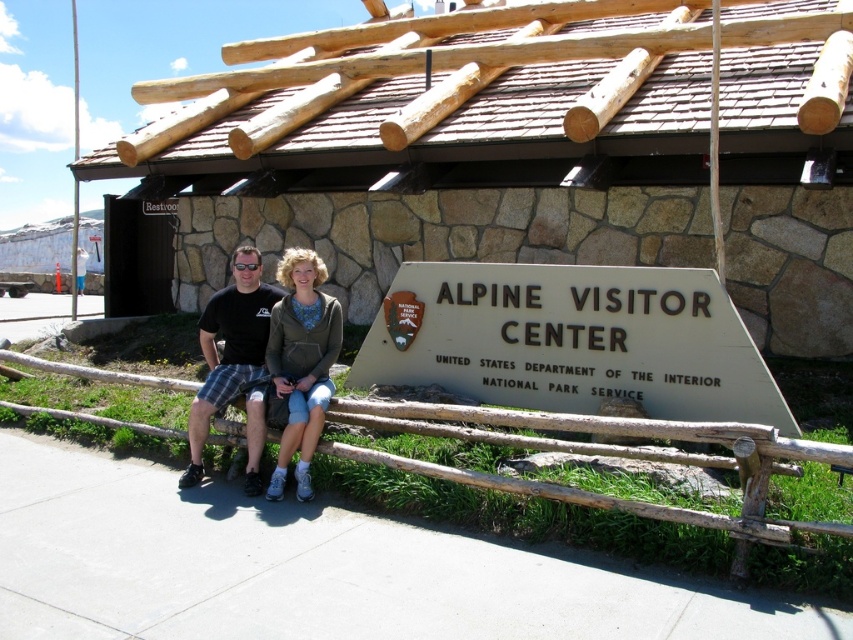
Does point (573, 346) lie in front of point (318, 381)?

That is False.

Can you confirm if metallic gray sign at center is positioned below green textured hoodie at center?

Incorrect, metallic gray sign at center is not positioned below green textured hoodie at center.

Is point (540, 378) in front of point (340, 320)?

No, (540, 378) is behind (340, 320).

Where is `metallic gray sign at center`? metallic gray sign at center is located at coordinates (572, 340).

Who is lower down, green textured hoodie at center or black plaid shorts at center?

green textured hoodie at center

This screenshot has width=853, height=640. What do you see at coordinates (300, 362) in the screenshot?
I see `green textured hoodie at center` at bounding box center [300, 362].

Locate an element on the screen. The height and width of the screenshot is (640, 853). green textured hoodie at center is located at coordinates (300, 362).

Which is above, metallic gray sign at center or black plaid shorts at center?

metallic gray sign at center is higher up.

Which is below, metallic gray sign at center or black plaid shorts at center?

Positioned lower is black plaid shorts at center.

You are a GUI agent. You are given a task and a screenshot of the screen. Output one action in this format:
    pyautogui.click(x=<x>, y=<y>)
    Task: Click on the metallic gray sign at center
    
    Given the screenshot: What is the action you would take?
    pyautogui.click(x=572, y=340)

Find the location of a particular element. The height and width of the screenshot is (640, 853). metallic gray sign at center is located at coordinates (572, 340).